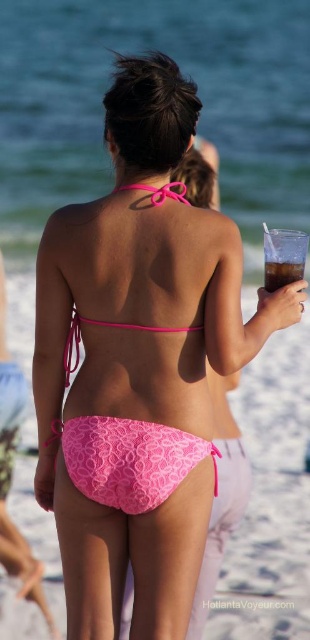
Consider the image. Is pink lace bikini at center thinner than translucent plastic cup at upper right?

Incorrect, pink lace bikini at center's width is not less than translucent plastic cup at upper right's.

Who is more forward, (94, 468) or (292, 260)?

Point (94, 468) is in front.

In order to click on pink lace bikini at center in this screenshot , I will do `click(129, 460)`.

At what (x,y) coordinates should I click in order to perform the action: click on pink lace bikini at center. Please return your answer as a coordinate pair (x, y). This screenshot has width=310, height=640. Looking at the image, I should click on (129, 460).

What do you see at coordinates (129, 460) in the screenshot? I see `pink lace bikini at center` at bounding box center [129, 460].

Does pink lace bikini at center appear under pink lace bikini top at upper center?

Yes, pink lace bikini at center is below pink lace bikini top at upper center.

Is point (110, 438) positioned after point (137, 188)?

No.

At what (x,y) coordinates should I click in order to perform the action: click on pink lace bikini at center. Please return your answer as a coordinate pair (x, y). The height and width of the screenshot is (640, 310). Looking at the image, I should click on (129, 460).

Which is in front, point (283, 262) or point (163, 196)?

Positioned in front is point (283, 262).

Is translucent plastic cup at upper right below pink lace bikini top at upper center?

Yes, translucent plastic cup at upper right is below pink lace bikini top at upper center.

Image resolution: width=310 pixels, height=640 pixels. Find the location of `translucent plastic cup at upper right`. translucent plastic cup at upper right is located at coordinates (282, 273).